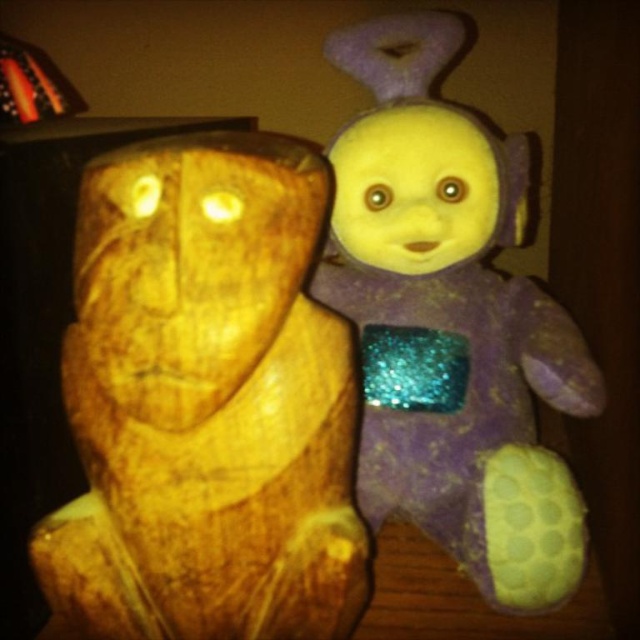
Who is taller, wooden carving at left or purple glittery plush at upper right?

Standing taller between the two is purple glittery plush at upper right.

Does point (224, 436) lie behind point (342, 209)?

No.

Is point (209, 385) closer to viewer compared to point (374, 520)?

Yes, it is in front of point (374, 520).

This screenshot has width=640, height=640. Identify the location of wooden carving at left. (205, 401).